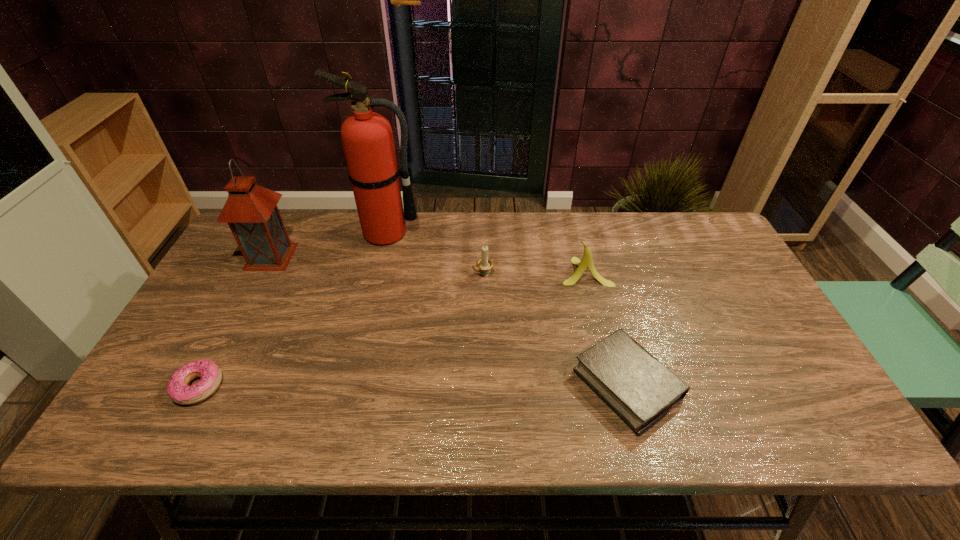
Find the location of a particular element. free space in the image that satisfies the following two spatial constraints: 1. on the back side of the second tallest object; 2. on the left side of the shortest object is located at coordinates (267, 256).

Where is `vacant space that satisfies the following two spatial constraints: 1. at the nozzle of the banana; 2. on the left side of the fire extinguisher`? Image resolution: width=960 pixels, height=540 pixels. vacant space that satisfies the following two spatial constraints: 1. at the nozzle of the banana; 2. on the left side of the fire extinguisher is located at coordinates (377, 272).

You are a GUI agent. You are given a task and a screenshot of the screen. Output one action in this format:
    pyautogui.click(x=<x>, y=<y>)
    Task: Click on the vacant space that satisfies the following two spatial constraints: 1. at the nozzle of the tallest object; 2. on the right side of the fifth tallest object
    This screenshot has width=960, height=540.
    Given the screenshot: What is the action you would take?
    pyautogui.click(x=350, y=384)

The width and height of the screenshot is (960, 540). In order to click on vacant space that satisfies the following two spatial constraints: 1. on the handle side of the candle_holder; 2. on the left side of the Bible in this screenshot , I will do `click(484, 384)`.

The width and height of the screenshot is (960, 540). In order to click on free point that satisfies the following two spatial constraints: 1. on the back side of the shortest object; 2. on the right side of the fifth tallest object in this screenshot , I will do `click(200, 384)`.

In order to click on vacant space that satisfies the following two spatial constraints: 1. on the back side of the second shortest object; 2. on the left side of the doughnut in this screenshot , I will do `click(200, 384)`.